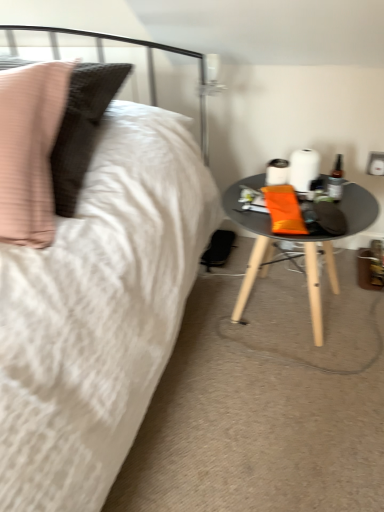
This screenshot has height=512, width=384. I want to click on vacant space to the right of translucent glass bottle at right, so click(358, 199).